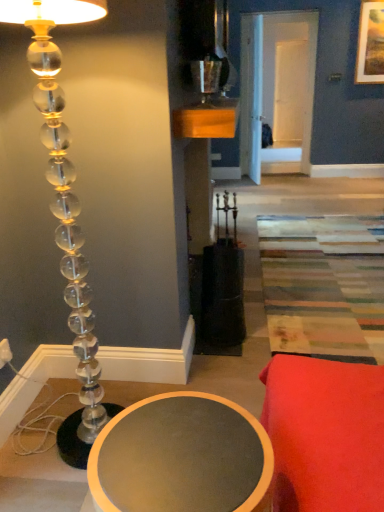
The image size is (384, 512). I want to click on wooden framed landscape painting at upper right, so click(370, 42).

The height and width of the screenshot is (512, 384). Identify the location of metallic silver candle holder at upper center. (207, 81).

Identify the location of wooden framed landscape painting at upper right. The height and width of the screenshot is (512, 384). (370, 42).

Which of these two, matte gray table at lower left or wooden framed landscape painting at upper right, stands taller?

With more height is wooden framed landscape painting at upper right.

Between matte gray table at lower left and wooden framed landscape painting at upper right, which one has smaller size?

wooden framed landscape painting at upper right is smaller.

Looking at their sizes, would you say matte gray table at lower left is wider or thinner than wooden framed landscape painting at upper right?

Clearly, matte gray table at lower left has more width compared to wooden framed landscape painting at upper right.

Where is `lamp below the metallic silver candle holder at upper center (from a real-world perspective)`? The height and width of the screenshot is (512, 384). lamp below the metallic silver candle holder at upper center (from a real-world perspective) is located at coordinates (66, 206).

Is point (214, 88) positioned in front of point (54, 72)?

No, it is not.

Based on the photo, is metallic silver candle holder at upper center positioned far away from clear acrylic lamp at left?

No, metallic silver candle holder at upper center is in close proximity to clear acrylic lamp at left.

Does wooden framed landscape painting at upper right appear on the right side of clear acrylic lamp at left?

Yes.

Locate an element on the screen. Image resolution: width=384 pixels, height=512 pixels. picture frame located above the clear acrylic lamp at left (from a real-world perspective) is located at coordinates (370, 42).

From a real-world perspective, is wooden framed landscape painting at upper right physically located above or below clear acrylic lamp at left?

From a real-world perspective, wooden framed landscape painting at upper right is physically above clear acrylic lamp at left.

Which is in front, point (79, 16) or point (181, 486)?

The point (181, 486) is more forward.

From a real-world perspective, is clear acrylic lamp at left physically below matte gray table at lower left?

No, from a real-world perspective, clear acrylic lamp at left is not below matte gray table at lower left.

Considering the relative sizes of clear acrylic lamp at left and matte gray table at lower left in the image provided, is clear acrylic lamp at left smaller than matte gray table at lower left?

No.

The width and height of the screenshot is (384, 512). What are the coordinates of `lamp that is above the matte gray table at lower left (from a real-world perspective)` in the screenshot? It's located at [x=66, y=206].

I want to click on table beneath the wooden framed landscape painting at upper right (from a real-world perspective), so click(181, 457).

Is wooden framed landscape painting at upper right to the left of matte gray table at lower left from the viewer's perspective?

Incorrect, wooden framed landscape painting at upper right is not on the left side of matte gray table at lower left.

Could you measure the distance between wooden framed landscape painting at upper right and matte gray table at lower left?

17.57 feet.

Could you tell me if wooden framed landscape painting at upper right is turned towards matte gray table at lower left?

No, wooden framed landscape painting at upper right is not facing towards matte gray table at lower left.

Is clear acrylic lamp at left next to metallic silver candle holder at upper center and touching it?

No, clear acrylic lamp at left is not in contact with metallic silver candle holder at upper center.

Can you confirm if clear acrylic lamp at left is taller than metallic silver candle holder at upper center?

Correct, clear acrylic lamp at left is much taller as metallic silver candle holder at upper center.

From the image's perspective, is clear acrylic lamp at left beneath metallic silver candle holder at upper center?

Yes.

Considering the positions of objects wooden framed landscape painting at upper right and metallic silver candle holder at upper center in the image provided, who is more to the left, wooden framed landscape painting at upper right or metallic silver candle holder at upper center?

Positioned to the left is metallic silver candle holder at upper center.

From a real-world perspective, is wooden framed landscape painting at upper right under metallic silver candle holder at upper center?

Actually, wooden framed landscape painting at upper right is physically above metallic silver candle holder at upper center in the real world.

Considering the sizes of objects wooden framed landscape painting at upper right and metallic silver candle holder at upper center in the image provided, who is wider, wooden framed landscape painting at upper right or metallic silver candle holder at upper center?

metallic silver candle holder at upper center.

From the image's perspective, relative to metallic silver candle holder at upper center, is wooden framed landscape painting at upper right above or below?

From the image's perspective, wooden framed landscape painting at upper right appears above metallic silver candle holder at upper center.

This screenshot has height=512, width=384. Find the location of `table in front of the wooden framed landscape painting at upper right`. table in front of the wooden framed landscape painting at upper right is located at coordinates (181, 457).

At what (x,y) coordinates should I click in order to perform the action: click on lamp directly beneath the metallic silver candle holder at upper center (from a real-world perspective). Please return your answer as a coordinate pair (x, y). The width and height of the screenshot is (384, 512). Looking at the image, I should click on (66, 206).

From the image, which object appears to be nearer to matte gray table at lower left, wooden framed landscape painting at upper right or clear acrylic lamp at left?

clear acrylic lamp at left is closer to matte gray table at lower left.

Looking at the image, which one is located further to metallic silver candle holder at upper center, wooden framed landscape painting at upper right or matte gray table at lower left?

The object further to metallic silver candle holder at upper center is wooden framed landscape painting at upper right.

Which object lies further to the anchor point metallic silver candle holder at upper center, clear acrylic lamp at left or wooden framed landscape painting at upper right?

Among the two, wooden framed landscape painting at upper right is located further to metallic silver candle holder at upper center.

Consider the image. Looking at the image, which one is located closer to clear acrylic lamp at left, matte gray table at lower left or wooden framed landscape painting at upper right?

matte gray table at lower left is positioned closer to the anchor clear acrylic lamp at left.

Which object lies further to the anchor point clear acrylic lamp at left, wooden framed landscape painting at upper right or matte gray table at lower left?

Based on the image, wooden framed landscape painting at upper right appears to be further to clear acrylic lamp at left.

Looking at the image, which one is located closer to clear acrylic lamp at left, metallic silver candle holder at upper center or wooden framed landscape painting at upper right?

Based on the image, metallic silver candle holder at upper center appears to be nearer to clear acrylic lamp at left.

From the image, which object appears to be farther from matte gray table at lower left, clear acrylic lamp at left or wooden framed landscape painting at upper right?

wooden framed landscape painting at upper right is further to matte gray table at lower left.

When comparing their distances from clear acrylic lamp at left, does matte gray table at lower left or metallic silver candle holder at upper center seem closer?

matte gray table at lower left lies closer to clear acrylic lamp at left than the other object.

Identify the location of lamp between metallic silver candle holder at upper center and matte gray table at lower left in the vertical direction. [66, 206].

In order to click on candle holder located between clear acrylic lamp at left and wooden framed landscape painting at upper right in the depth direction in this screenshot , I will do `click(207, 81)`.

Identify the location of lamp located between matte gray table at lower left and wooden framed landscape painting at upper right in the depth direction. (66, 206).

You are a GUI agent. You are given a task and a screenshot of the screen. Output one action in this format:
    pyautogui.click(x=<x>, y=<y>)
    Task: Click on the candle holder positioned between matte gray table at lower left and wooden framed landscape painting at upper right from near to far
    
    Given the screenshot: What is the action you would take?
    pyautogui.click(x=207, y=81)